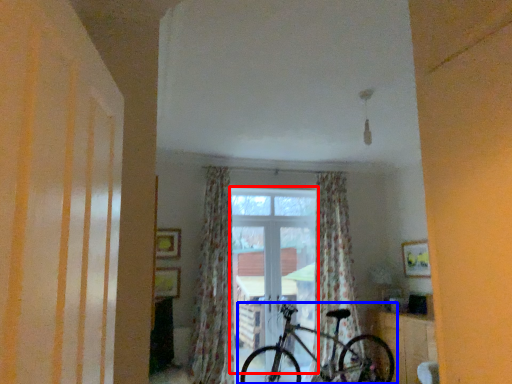
Question: Which point is further to the camera, window (highlighted by a red box) or bicycle (highlighted by a blue box)?

Choices:
 (A) window
 (B) bicycle

Answer: (A)